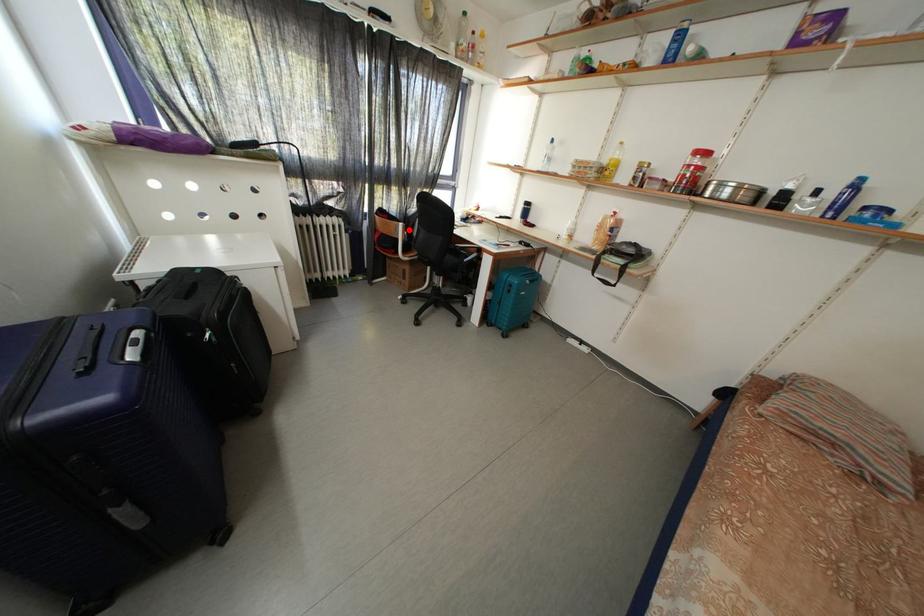
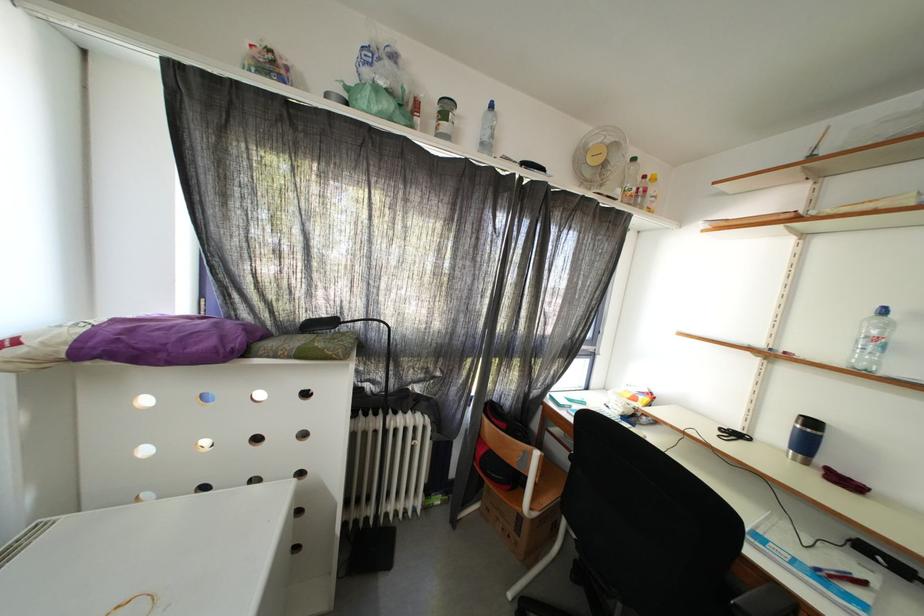
Locate, in the second image, the point that corresponds to the highlighted location in the first image.

(544, 458)